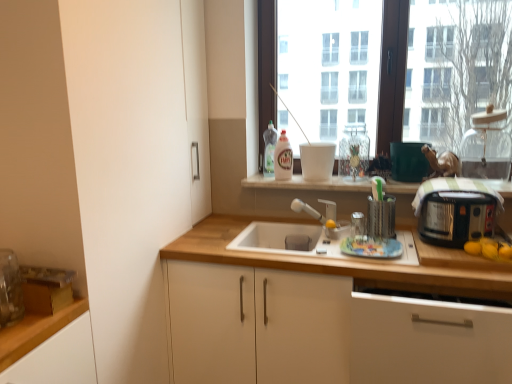
This screenshot has height=384, width=512. I want to click on vacant space situated on the left part of matte silver faucet at center, so click(x=273, y=235).